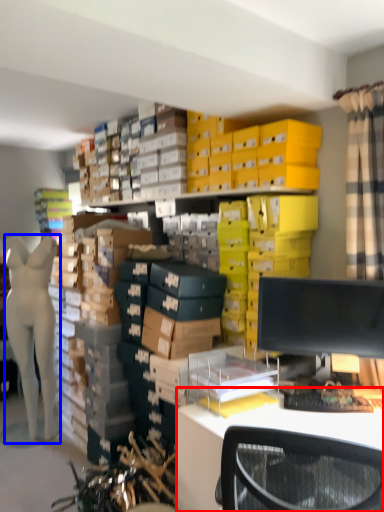
Question: Which object is further to the camera taking this photo, desk (highlighted by a red box) or person (highlighted by a blue box)?

Choices:
 (A) desk
 (B) person

Answer: (B)